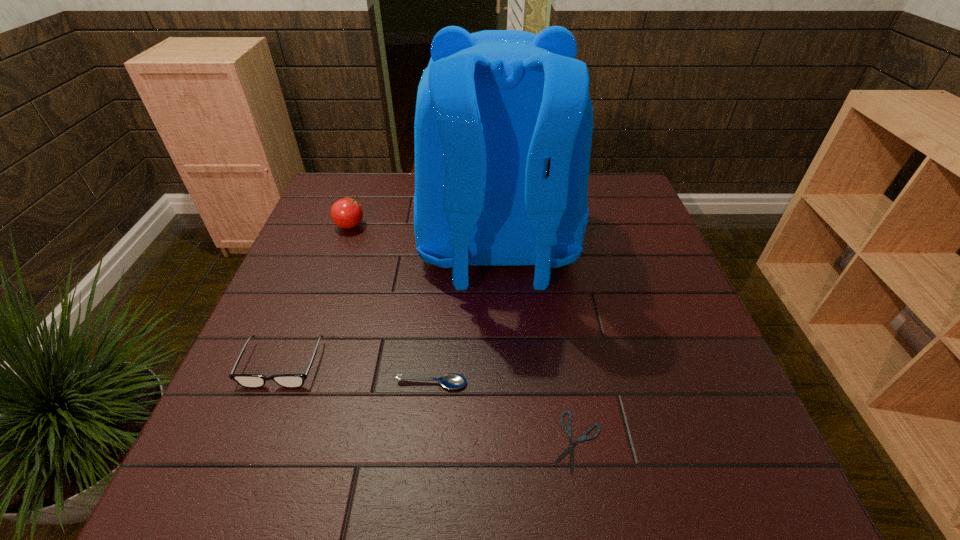
You are a GUI agent. You are given a task and a screenshot of the screen. Output one action in this format:
    pyautogui.click(x=<x>, y=<y>)
    Task: Click on the vacant space at the near right corner of the desktop
    
    Given the screenshot: What is the action you would take?
    pyautogui.click(x=691, y=499)

Find the location of a particular element. The width and height of the screenshot is (960, 540). vacant space in between the soupspoon and the third tallest object is located at coordinates (357, 374).

Where is `unoccupied area between the tallest object and the fourth tallest object`? unoccupied area between the tallest object and the fourth tallest object is located at coordinates (465, 316).

I want to click on free space between the shortest object and the spectacles, so click(429, 403).

Image resolution: width=960 pixels, height=540 pixels. I want to click on empty location between the apple and the nearest object, so click(x=464, y=334).

This screenshot has height=540, width=960. Find the location of `empty space between the third tallest object and the soupspoon`. empty space between the third tallest object and the soupspoon is located at coordinates (357, 374).

Identify the location of vacant area that lies between the soupspoon and the backpack. (465, 316).

Identify the location of vacant space in between the third shortest object and the apple. (316, 295).

Identify the location of vacant space that is in between the spectacles and the second tallest object. The height and width of the screenshot is (540, 960). (316, 295).

Where is `the second closest object to the third shortest object`? This screenshot has height=540, width=960. the second closest object to the third shortest object is located at coordinates (503, 127).